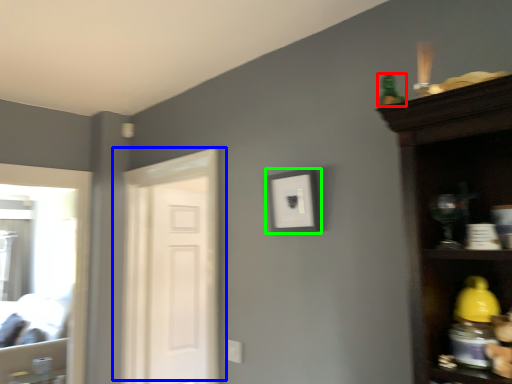
Question: Estimate the real-world distances between objects in this image. Which object is farther from toy (highlighted by a red box), door (highlighted by a blue box) or picture frame (highlighted by a green box)?

Choices:
 (A) door
 (B) picture frame

Answer: (A)